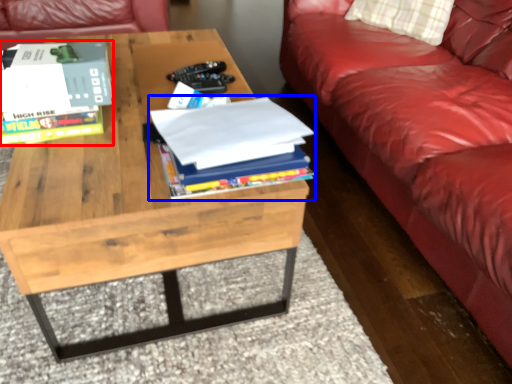
Question: Among these objects, which one is farthest to the camera, book (highlighted by a red box) or book (highlighted by a blue box)?

Choices:
 (A) book
 (B) book

Answer: (A)